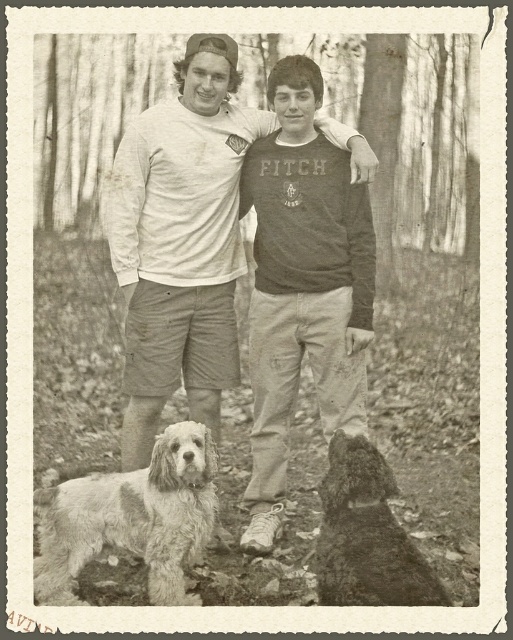
You are a photographer setting up a tripod to take a group photo of the two dogs in the scene. The tripod has a maximum width capacity of 1.2 meters between the two subjects. Based on their sizes, will the fuzzy fur dog at lower left and the shaggy dark fur dog at lower right fit within this width requirement?

The fuzzy fur dog at lower left is larger in width than the shaggy dark fur dog at lower right. However, the total width between them would depend on their positions. Since the description only mentions their individual widths and not the distance between them, we cannot determine if they fit within the 1.2 meters. More information about their spacing is needed.